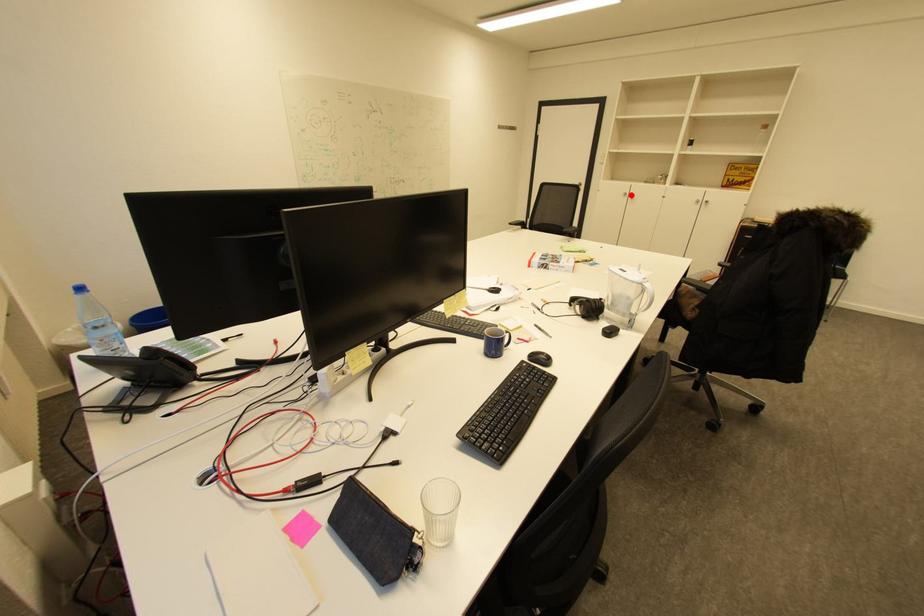
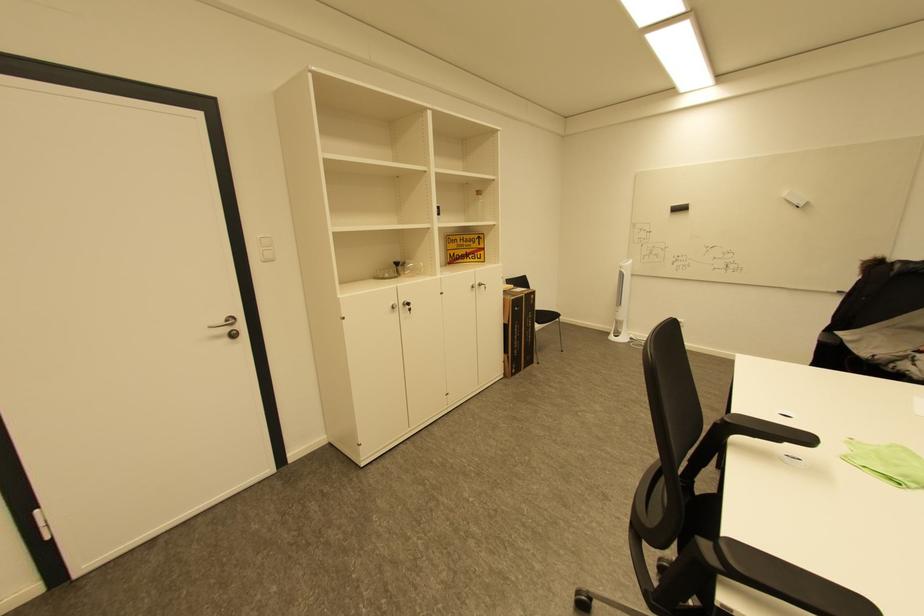
Where in the second image is the point corresponding to the highlighted location from the first image?

(398, 308)